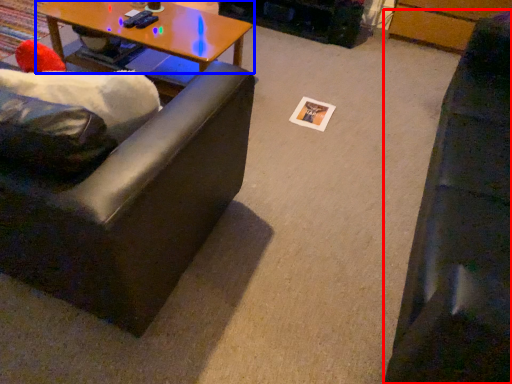
Question: Which object is closer to the camera taking this photo, studio couch (highlighted by a red box) or coffee table (highlighted by a blue box)?

Choices:
 (A) studio couch
 (B) coffee table

Answer: (A)